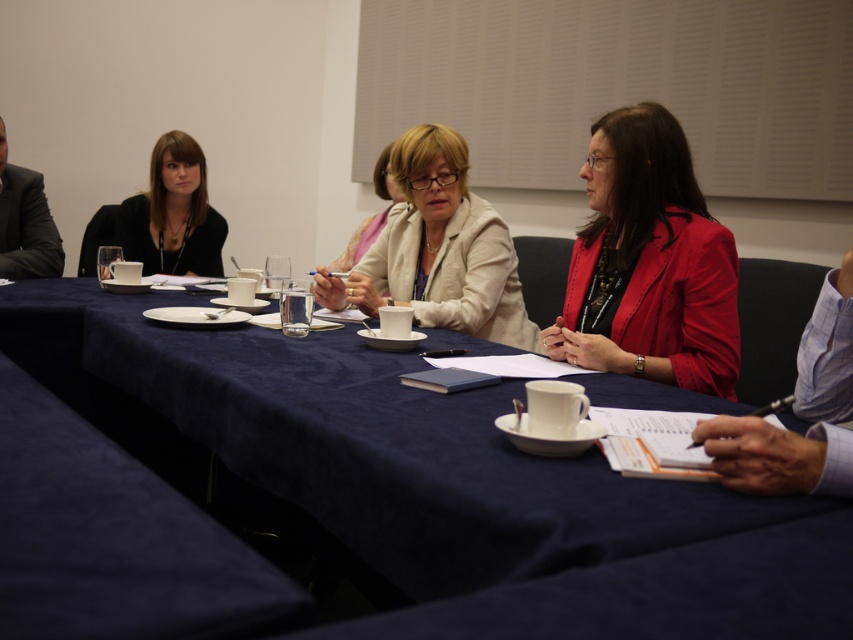
Can you confirm if matte red blazer at center is smaller than matte beige blazer at center?

Yes.

Find the location of a particular element. This screenshot has width=853, height=640. matte red blazer at center is located at coordinates (648, 262).

Find the location of `matte red blazer at center`. matte red blazer at center is located at coordinates (648, 262).

Which of these two, matte red blazer at center or matte beige jacket at center, stands taller?

matte red blazer at center

Does matte red blazer at center have a greater width compared to matte beige jacket at center?

Yes.

Does point (625, 232) come behind point (341, 252)?

No, it is not.

The image size is (853, 640). In order to click on matte red blazer at center in this screenshot , I will do `click(648, 262)`.

Which of these two, matte red blazer at center or matte black jacket at upper left, stands shorter?

With less height is matte black jacket at upper left.

Which is more to the left, matte red blazer at center or matte black jacket at upper left?

From the viewer's perspective, matte black jacket at upper left appears more on the left side.

Which is behind, point (724, 365) or point (136, 225)?

The point (136, 225) is behind.

I want to click on matte red blazer at center, so [x=648, y=262].